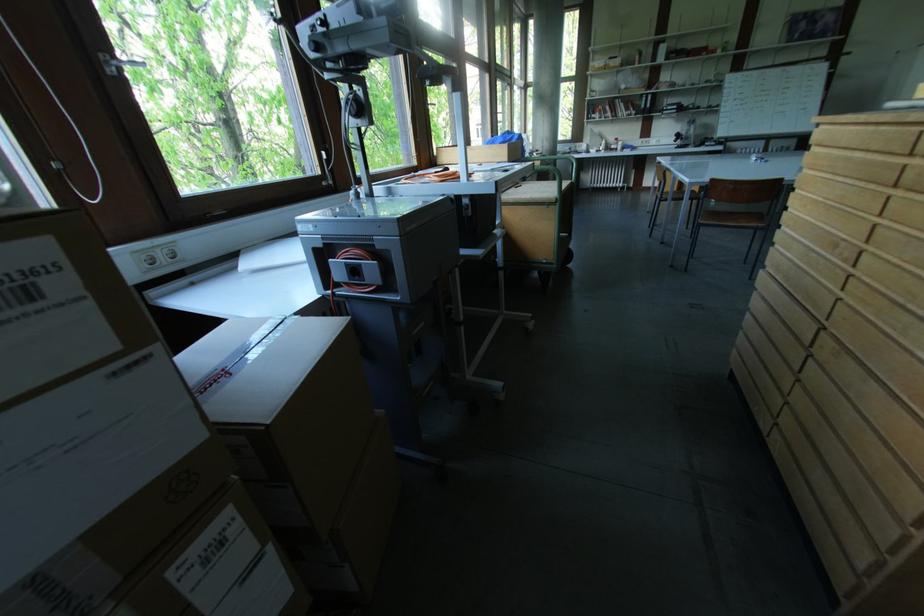
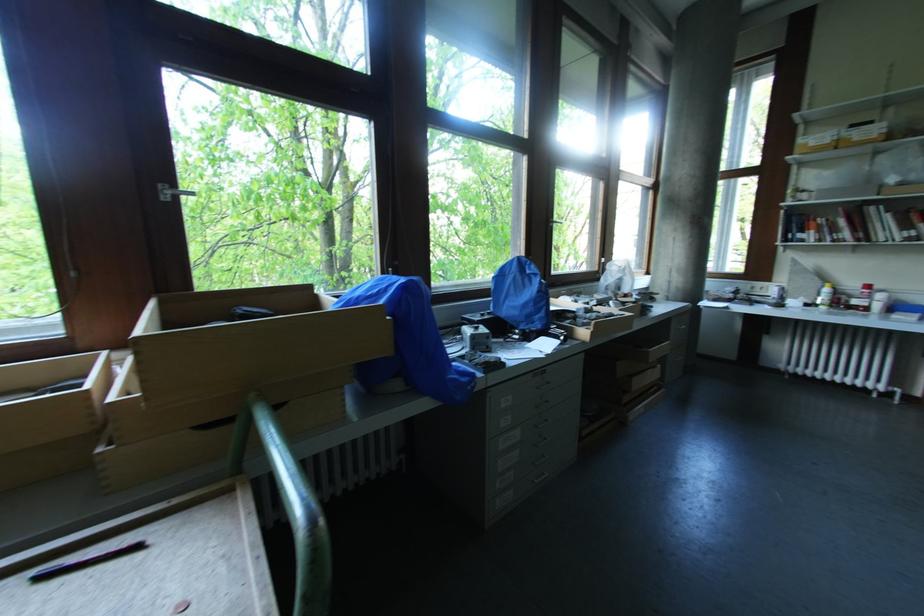
Where in the second image is the point corresponding to [623,145] from the first image?

(882, 298)